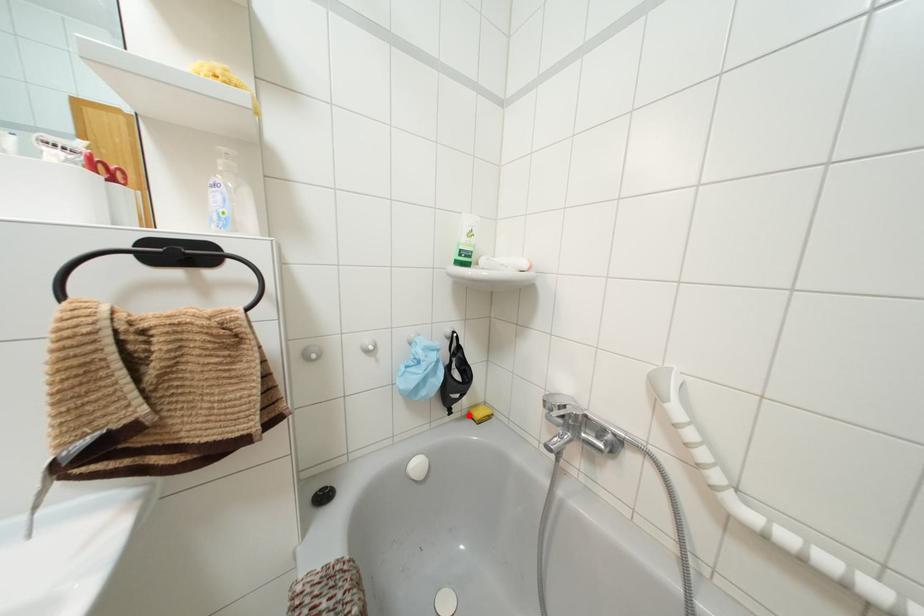
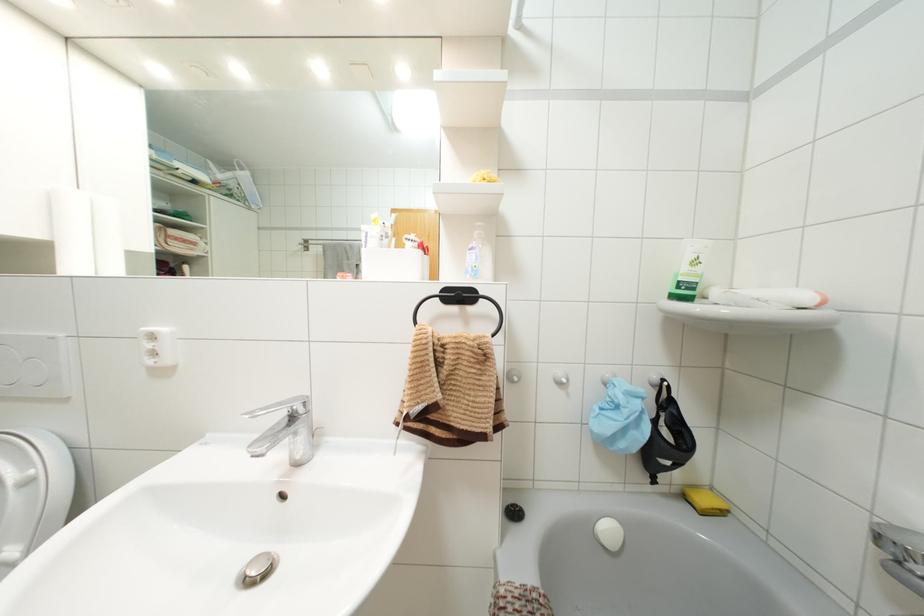
Locate, in the second image, the point that corresponds to the highlighted location in the first image.

(685, 496)